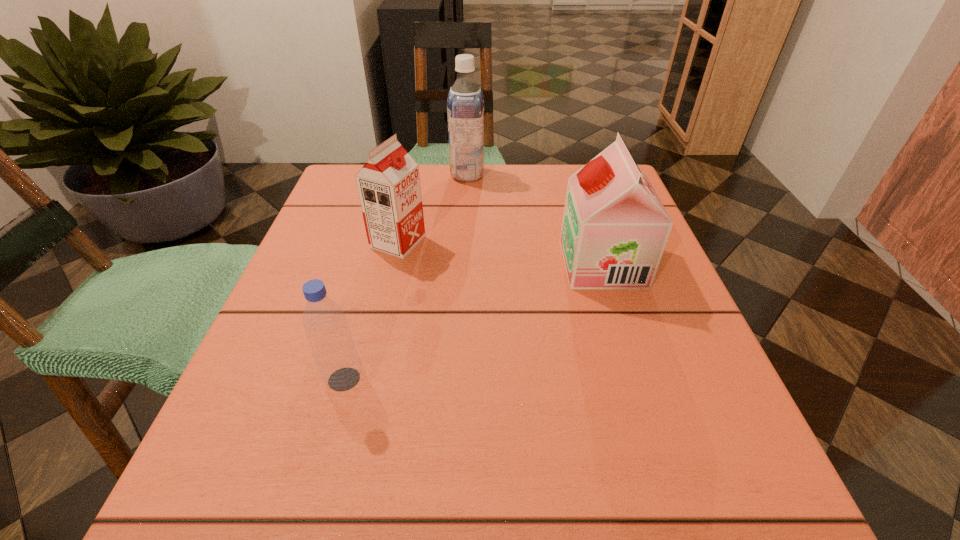
The image size is (960, 540). What are the coordinates of `free location at the far right corner of the desktop` in the screenshot? It's located at (562, 192).

This screenshot has width=960, height=540. I want to click on empty space that is in between the leftmost soya milk and the bottle, so click(x=371, y=311).

Locate an element on the screen. The height and width of the screenshot is (540, 960). free space between the farthest object and the leftmost soya milk is located at coordinates (433, 208).

Find the location of `free area in between the second object from right to left and the leftmost soya milk`. free area in between the second object from right to left and the leftmost soya milk is located at coordinates (433, 208).

Locate an element on the screen. Image resolution: width=960 pixels, height=540 pixels. vacant area that lies between the rightmost soya milk and the tallest soya milk is located at coordinates (535, 219).

This screenshot has height=540, width=960. Identify the location of free space between the bottle and the leftmost soya milk. (371, 311).

Where is `free space between the nearest object and the rightmost object`? The height and width of the screenshot is (540, 960). free space between the nearest object and the rightmost object is located at coordinates [x=473, y=321].

I want to click on free spot between the farthest soya milk and the leftmost soya milk, so click(433, 208).

At what (x,y) coordinates should I click in order to perform the action: click on free area in between the rightmost object and the leftmost soya milk. Please return your answer as a coordinate pair (x, y). Looking at the image, I should click on (500, 253).

Where is `free point between the leftmost soya milk and the bottle`? This screenshot has height=540, width=960. free point between the leftmost soya milk and the bottle is located at coordinates (371, 311).